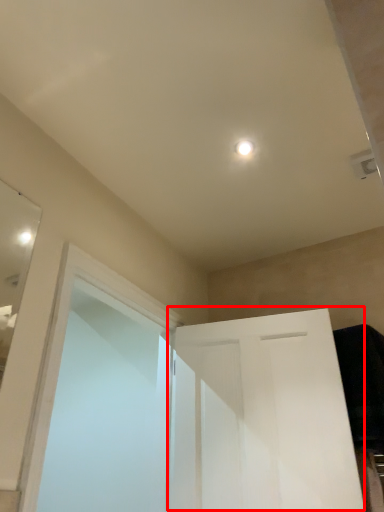
Question: From the image's perspective, considering the relative positions of door (annotated by the red box) and screen door in the image provided, where is door (annotated by the red box) located with respect to the staircase?

Choices:
 (A) below
 (B) above

Answer: (A)